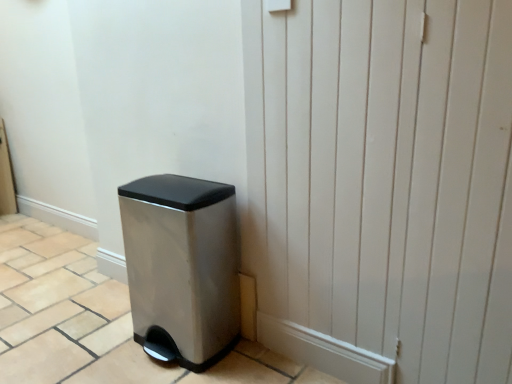
Question: From the image's perspective, is satin silver trash can at lower left on top of white wood screen door at lower right?

Choices:
 (A) no
 (B) yes

Answer: (A)

Question: Would you say white wood screen door at lower right is part of satin silver trash can at lower left's contents?

Choices:
 (A) yes
 (B) no

Answer: (B)

Question: Does satin silver trash can at lower left come behind white wood screen door at lower right?

Choices:
 (A) no
 (B) yes

Answer: (B)

Question: Is satin silver trash can at lower left far away from white wood screen door at lower right?

Choices:
 (A) no
 (B) yes

Answer: (A)

Question: Is satin silver trash can at lower left facing away from white wood screen door at lower right?

Choices:
 (A) no
 (B) yes

Answer: (A)

Question: From a real-world perspective, is satin silver trash can at lower left below white wood screen door at lower right?

Choices:
 (A) no
 (B) yes

Answer: (B)

Question: Is satin silver trash can at lower left a part of white wood screen door at lower right?

Choices:
 (A) no
 (B) yes

Answer: (A)

Question: Is white wood screen door at lower right directly adjacent to satin silver trash can at lower left?

Choices:
 (A) yes
 (B) no

Answer: (B)

Question: From the image's perspective, does white wood screen door at lower right appear higher than satin silver trash can at lower left?

Choices:
 (A) no
 (B) yes

Answer: (B)

Question: Is white wood screen door at lower right far from satin silver trash can at lower left?

Choices:
 (A) no
 (B) yes

Answer: (A)

Question: Is white wood screen door at lower right wider than satin silver trash can at lower left?

Choices:
 (A) yes
 (B) no

Answer: (B)

Question: Is white wood screen door at lower right taller than satin silver trash can at lower left?

Choices:
 (A) no
 (B) yes

Answer: (B)

Question: In terms of width, does white wood screen door at lower right look wider or thinner when compared to satin silver trash can at lower left?

Choices:
 (A) thin
 (B) wide

Answer: (A)